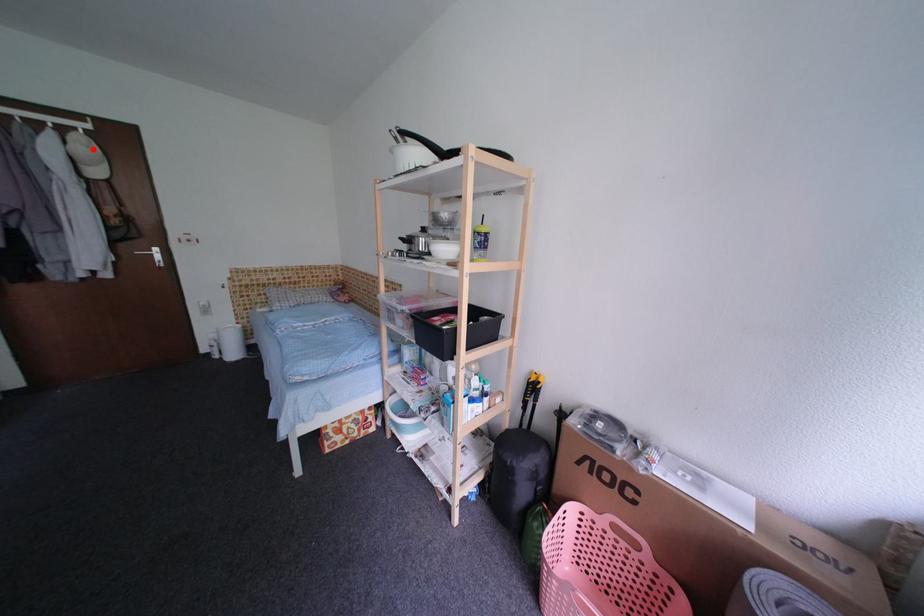
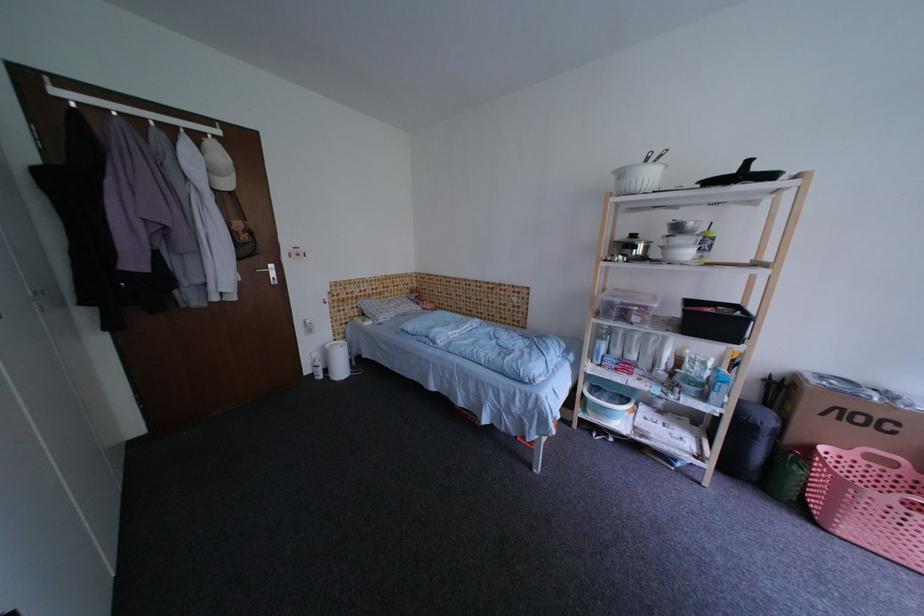
Where in the second image is the point corresponding to the highlighted location from the first image?

(227, 158)